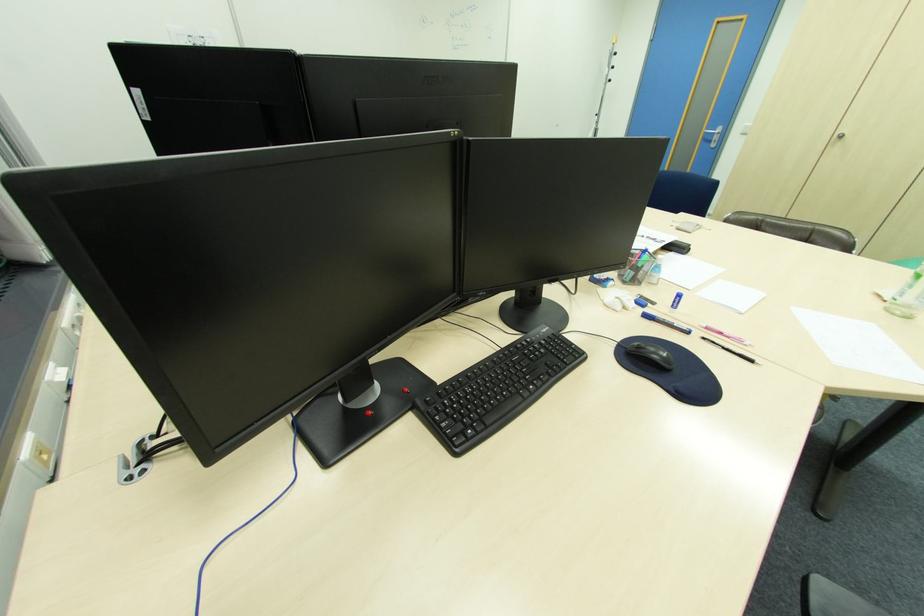
The height and width of the screenshot is (616, 924). Find the location of `black keyboard`. black keyboard is located at coordinates (496, 389).